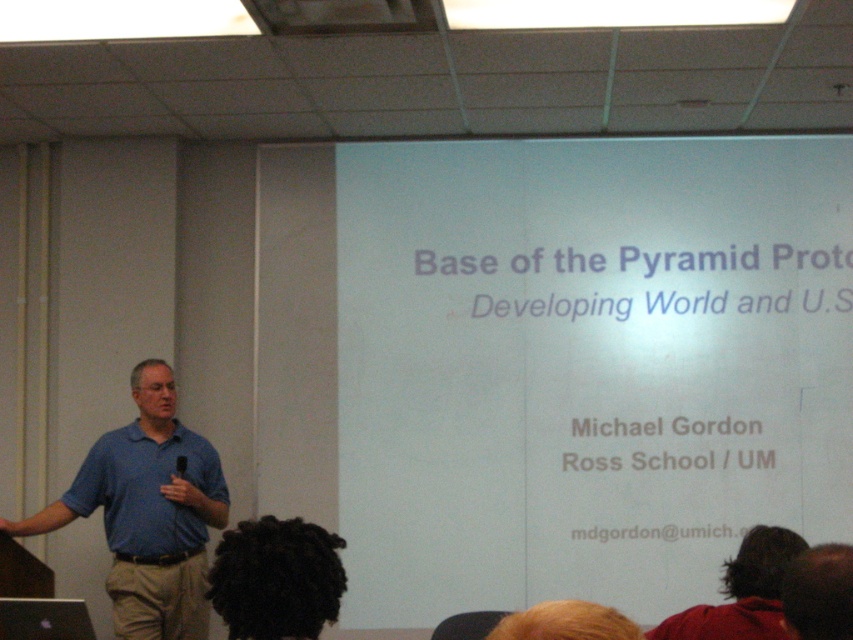
Question: Which point is closer to the camera taking this photo?

Choices:
 (A) (786, 547)
 (B) (167, 560)
 (C) (129, 474)

Answer: (A)

Question: Does white matte projection screen at upper center come behind black curly hair at lower center?

Choices:
 (A) no
 (B) yes

Answer: (B)

Question: Which point is closer to the camera?

Choices:
 (A) blue cotton shirt at left
 (B) black curly hair at lower center
 (C) dark red sweater at lower right

Answer: (B)

Question: In this image, where is blue cotton shirt at left located relative to black curly hair at lower center?

Choices:
 (A) right
 (B) left

Answer: (B)

Question: Based on their relative distances, which object is nearer to the matte blue shirt at left?

Choices:
 (A) black curly hair at lower center
 (B) blue cotton shirt at left

Answer: (B)

Question: Does black curly hair at lower center have a lesser width compared to dark red sweater at lower right?

Choices:
 (A) yes
 (B) no

Answer: (A)